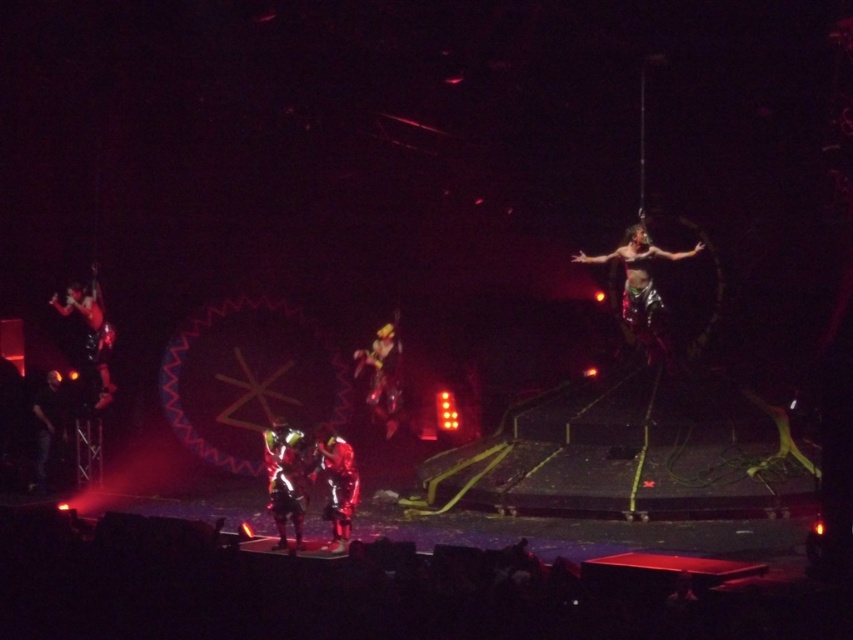
Question: Is shiny metallic person at center smaller than metallic gold costume at center?

Choices:
 (A) yes
 (B) no

Answer: (A)

Question: Which of these objects is positioned closest to the shiny metallic pants at upper right?

Choices:
 (A) shiny metallic costume at left
 (B) shiny metallic suit at center
 (C) shiny metallic person at center
 (D) metallic gold costume at center

Answer: (D)

Question: Which point is farther from the camera taking this photo?

Choices:
 (A) (650, 259)
 (B) (339, 448)
 (C) (57, 380)
 (D) (91, 326)

Answer: (C)

Question: Does shiny metallic suit at center have a smaller size compared to metallic gold costume at center?

Choices:
 (A) no
 (B) yes

Answer: (B)

Question: Among these points, which one is nearest to the camera?

Choices:
 (A) (695, 243)
 (B) (277, 502)
 (C) (42, 456)
 (D) (375, 410)

Answer: (B)

Question: Does metallic gold costume at center appear over dark fabric figure at left?

Choices:
 (A) no
 (B) yes

Answer: (B)